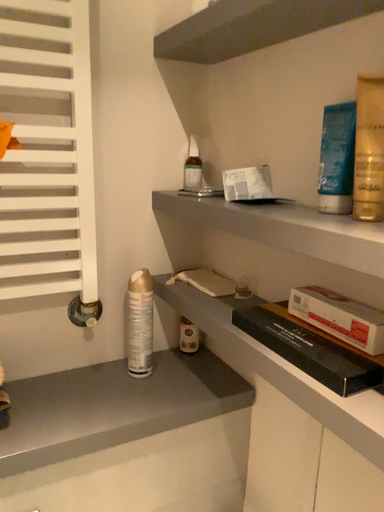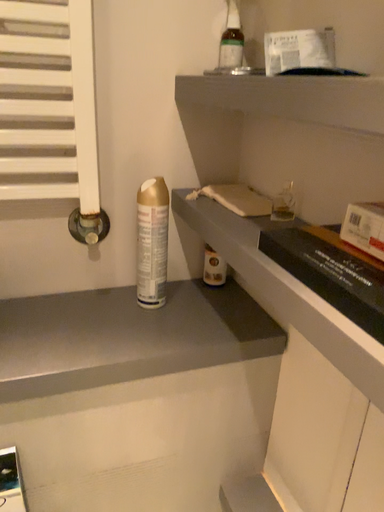
Question: How did the camera likely rotate when shooting the video?

Choices:
 (A) rotated downward
 (B) rotated upward

Answer: (A)